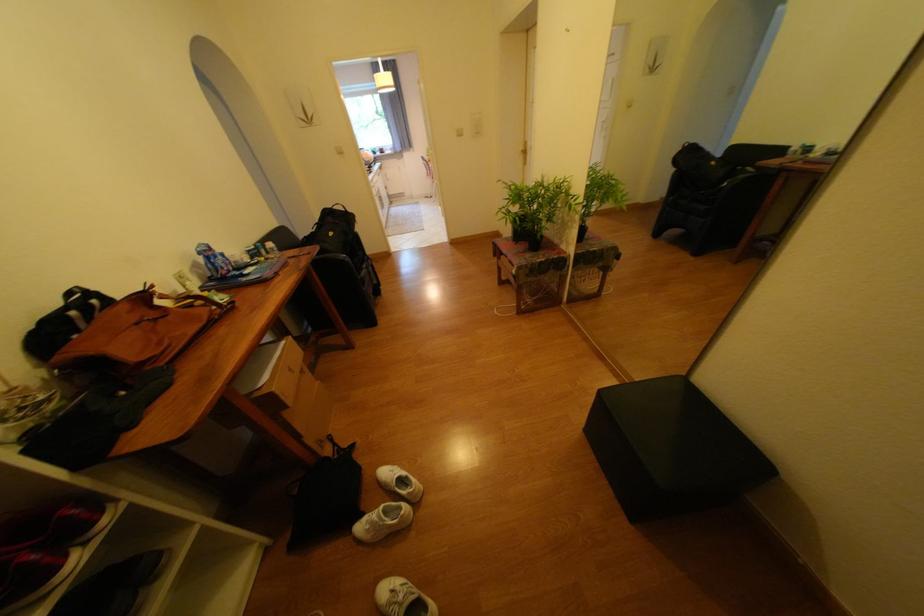
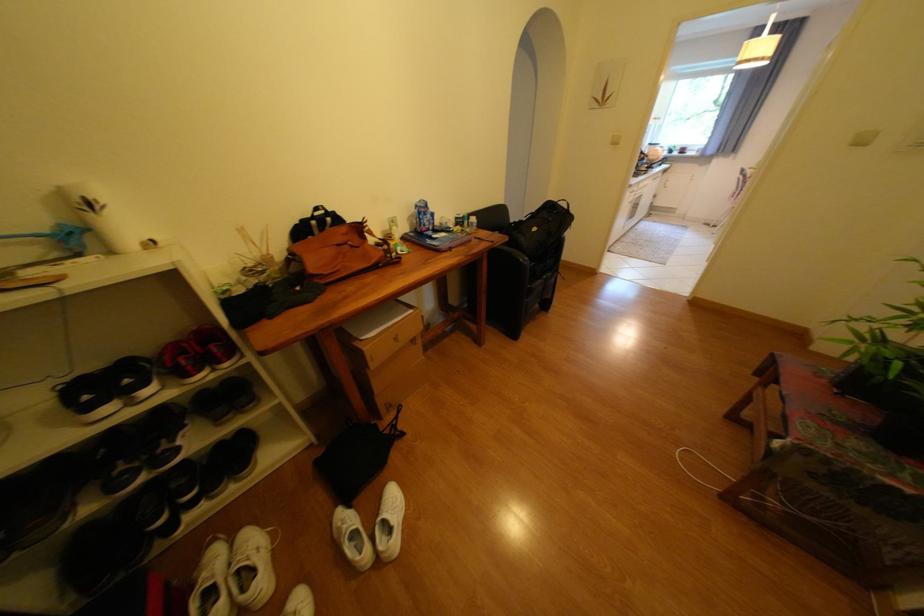
Find the pixel in the second image that matches the point at 341,233 in the first image.

(543, 230)